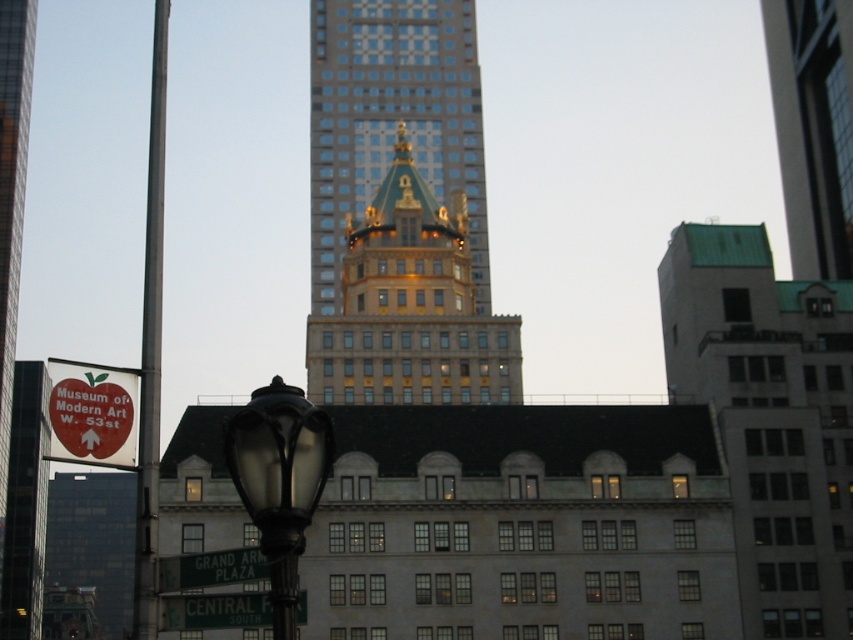
Question: Which point appears farthest from the camera in this image?

Choices:
 (A) (138, 627)
 (B) (250, 442)

Answer: (A)

Question: Does gold/golden stone tower at center have a greater width compared to green matte street sign at lower center?

Choices:
 (A) no
 (B) yes

Answer: (B)

Question: Is metallic glass skyscraper at upper right bigger than green matte street sign at lower center?

Choices:
 (A) yes
 (B) no

Answer: (A)

Question: Is matte black streetlight at lower left below metallic pole at left?

Choices:
 (A) no
 (B) yes

Answer: (B)

Question: Which object is farther from the camera taking this photo?

Choices:
 (A) metallic pole at left
 (B) metallic glass skyscraper at upper right

Answer: (B)

Question: Which of the following is the closest to the observer?

Choices:
 (A) metallic glass skyscraper at upper right
 (B) gold/golden stone tower at center
 (C) greensignboardstreet sign at lower center
 (D) gold/golden/ornate tower at center

Answer: (C)